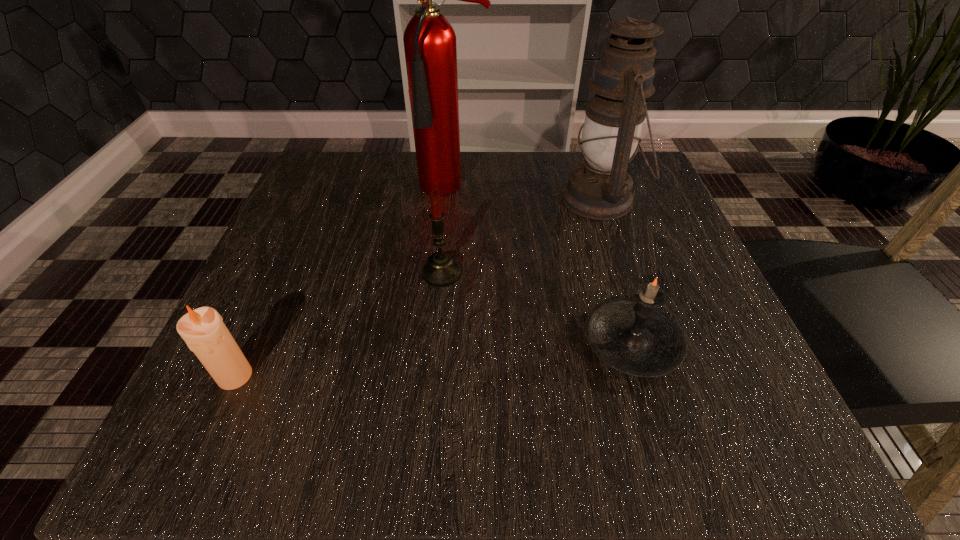
Find the location of a particular element. The image size is (960, 540). fire extinguisher is located at coordinates (429, 40).

Where is `the second tallest object`? The height and width of the screenshot is (540, 960). the second tallest object is located at coordinates (600, 188).

The image size is (960, 540). In order to click on the second candle from right to left in this screenshot , I will do `click(441, 270)`.

The height and width of the screenshot is (540, 960). In order to click on the farthest candle in this screenshot , I will do `click(441, 270)`.

This screenshot has height=540, width=960. What are the coordinates of `the leftmost object` in the screenshot? It's located at (203, 330).

This screenshot has height=540, width=960. In order to click on the rightmost candle in this screenshot , I will do `click(635, 336)`.

Identify the location of vacant space situated at the nozzle of the fire extinguisher. This screenshot has height=540, width=960. (444, 322).

At what (x,y) coordinates should I click in order to perform the action: click on blank space located 0.120m on the front of the fourth shortest object. Please return your answer as a coordinate pair (x, y). This screenshot has height=540, width=960. Looking at the image, I should click on (627, 278).

Locate an element on the screen. free space located on the front of the second candle from right to left is located at coordinates (438, 320).

This screenshot has height=540, width=960. Find the location of `vacant space situated 0.260m on the right of the leftmost candle`. vacant space situated 0.260m on the right of the leftmost candle is located at coordinates (442, 376).